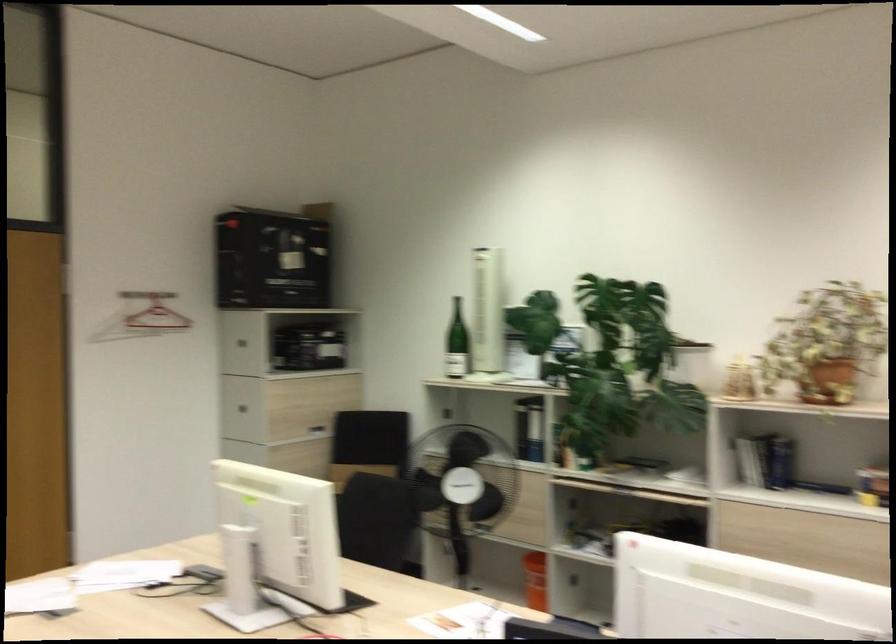
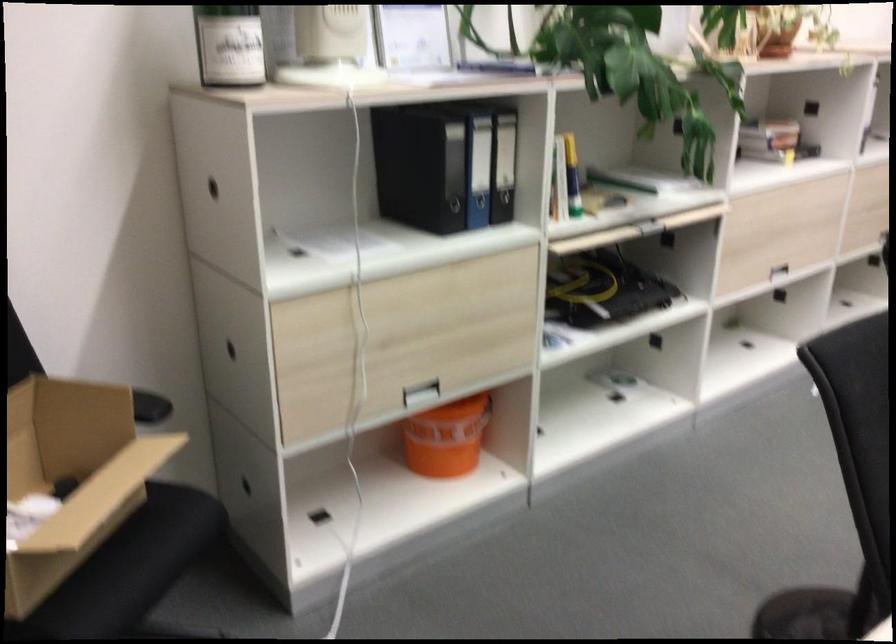
The point at [495,525] is marked in the first image. Where is the corresponding point in the second image?

(419, 393)